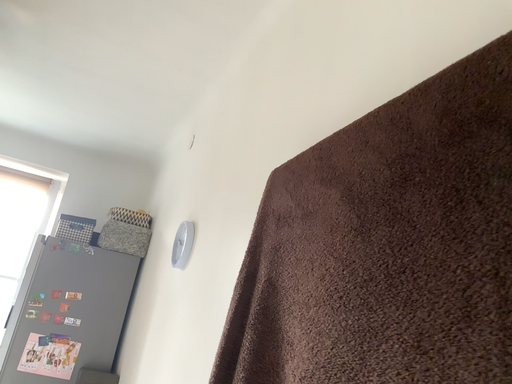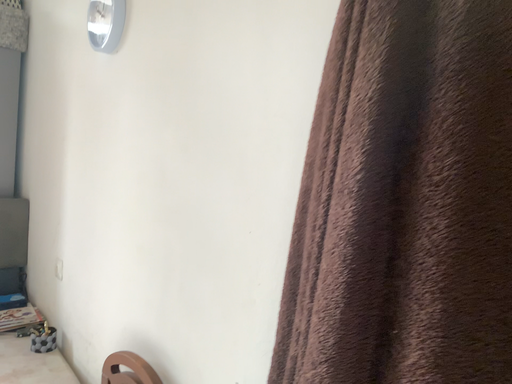
Question: Which way did the camera rotate in the video?

Choices:
 (A) rotated upward
 (B) rotated downward

Answer: (B)